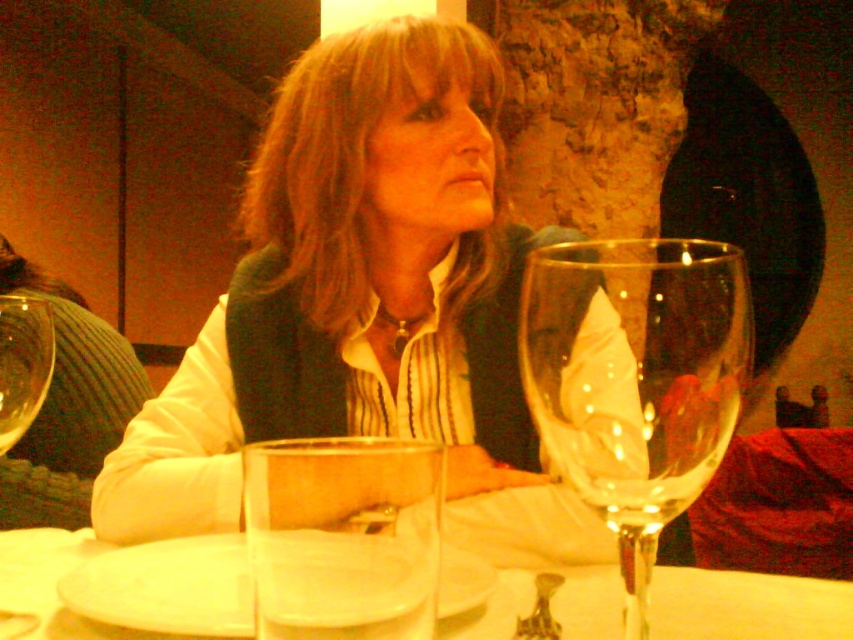
Looking at this image, you are a server at the restaurant and need to retrieve the clear glass cup at center from under the transparent glass wine glass at center. Can you do this without moving the wine glass?

The transparent glass wine glass at center is positioned over the clear glass cup at center, so you cannot retrieve the clear glass cup at center without moving the wine glass.

You are a server in a restaurant and need to place a new drink order for the customer seated at the table. The customer has already placed a transparent glass wine glass at center on the table. Where should you place the new drink to avoid overlapping with the existing glass?

The transparent glass wine glass at center is located at point (637, 380), so you should place the new drink in an area of the table that does not overlap with this coordinate to ensure there is enough space.